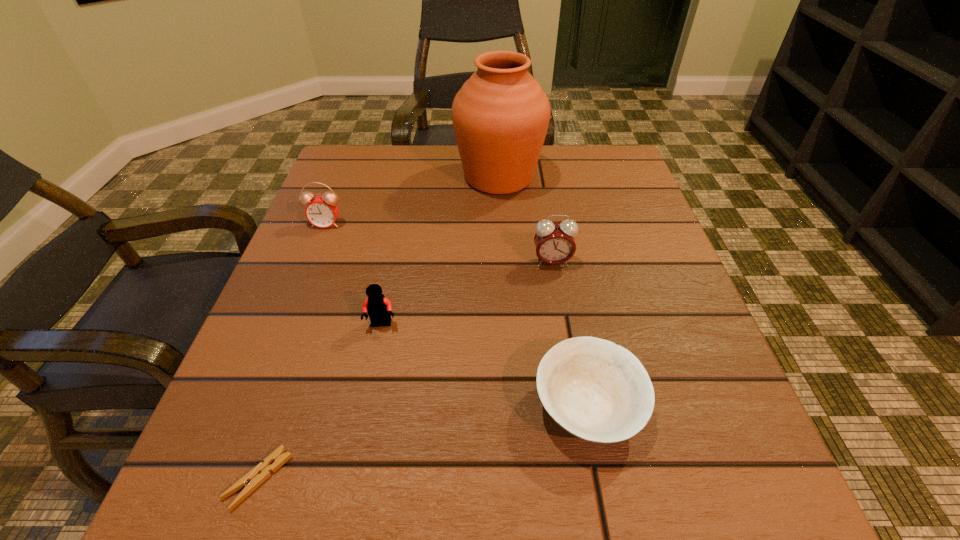
The image size is (960, 540). Identify the location of the farthest object. (500, 115).

Where is `the tallest object`? This screenshot has width=960, height=540. the tallest object is located at coordinates (500, 115).

I want to click on the right alarm clock, so click(x=555, y=244).

This screenshot has height=540, width=960. Identify the location of the nearer alarm clock. (555, 244).

The width and height of the screenshot is (960, 540). Find the location of `the fifth nearest object`. the fifth nearest object is located at coordinates (322, 211).

At what (x,y) coordinates should I click in order to perform the action: click on the left alarm clock. Please return your answer as a coordinate pair (x, y). This screenshot has height=540, width=960. Looking at the image, I should click on (322, 211).

I want to click on the fourth farthest object, so 378,307.

Find the location of `the third object from left to right`. the third object from left to right is located at coordinates [x=378, y=307].

The image size is (960, 540). Find the location of `bowl`. bowl is located at coordinates (596, 390).

You are a GUI agent. You are given a task and a screenshot of the screen. Output one action in this format:
    pyautogui.click(x=<x>, y=<y>)
    Task: Click on the shortest object
    The height and width of the screenshot is (540, 960).
    Given the screenshot: What is the action you would take?
    pyautogui.click(x=253, y=479)